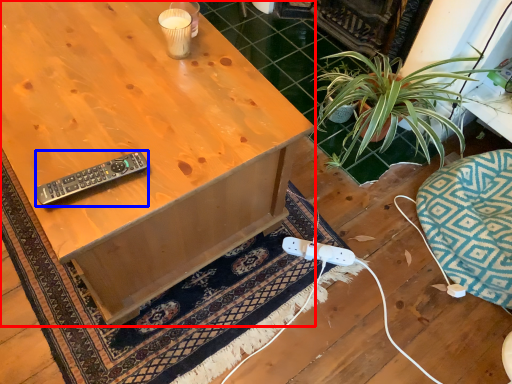
Question: Which object appears farthest to the camera in this image, desk (highlighted by a red box) or remote control (highlighted by a blue box)?

Choices:
 (A) desk
 (B) remote control

Answer: (B)